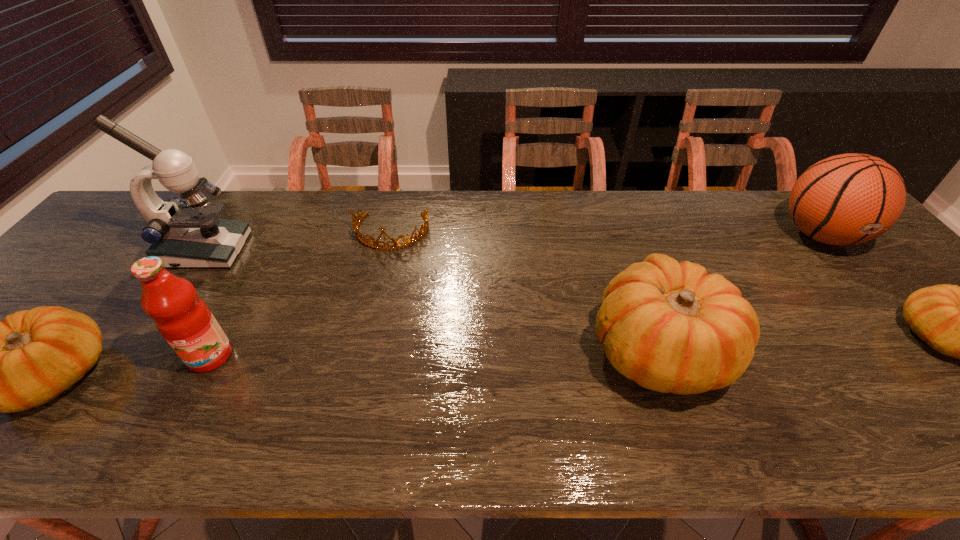
Please point a space for a new gourd to maintain equal intervals. Please provide its 2D coordinates. Your answer should be formatted as a tuple, i.e. [(x, y)], where the tuple contains the x and y coordinates of a point satisfying the conditions above.

[(364, 362)]